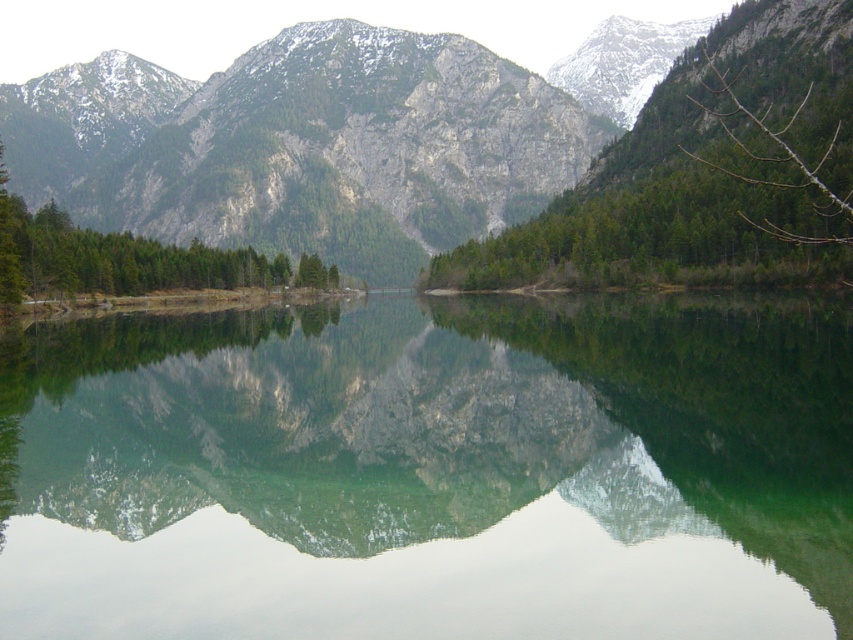
Between green reflective water at center and green matte tree at center, which one has more height?

green matte tree at center

Consider the image. Who is lower down, green reflective water at center or green matte tree at center?

green reflective water at center is lower down.

Between point (648, 628) and point (839, 93), which one is positioned in front?

Positioned in front is point (648, 628).

Locate an element on the screen. The width and height of the screenshot is (853, 640). green reflective water at center is located at coordinates (432, 468).

Does green reflective water at center have a larger size compared to green matte tree at left?

Actually, green reflective water at center might be smaller than green matte tree at left.

Does green reflective water at center come in front of green matte tree at left?

That is True.

Is point (325, 474) less distant than point (146, 284)?

Yes, point (325, 474) is closer to viewer.

I want to click on green reflective water at center, so click(x=432, y=468).

Is green matte tree at center further to camera compared to green matte tree at left?

No.

Between green matte tree at center and green matte tree at left, which one is positioned lower?

green matte tree at left

Is point (833, 115) farther from viewer compared to point (16, 284)?

Yes, it is behind point (16, 284).

This screenshot has height=640, width=853. I want to click on green matte tree at center, so click(x=704, y=172).